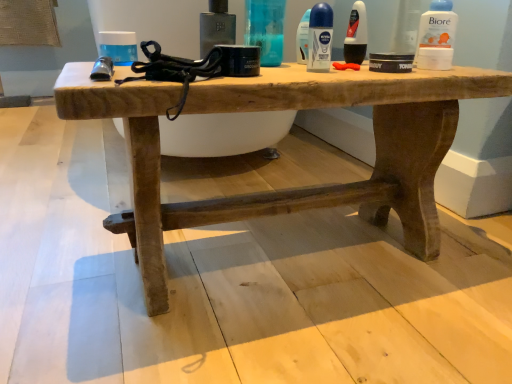
This screenshot has width=512, height=384. I want to click on free location in front of rustic wood table at center, so click(301, 334).